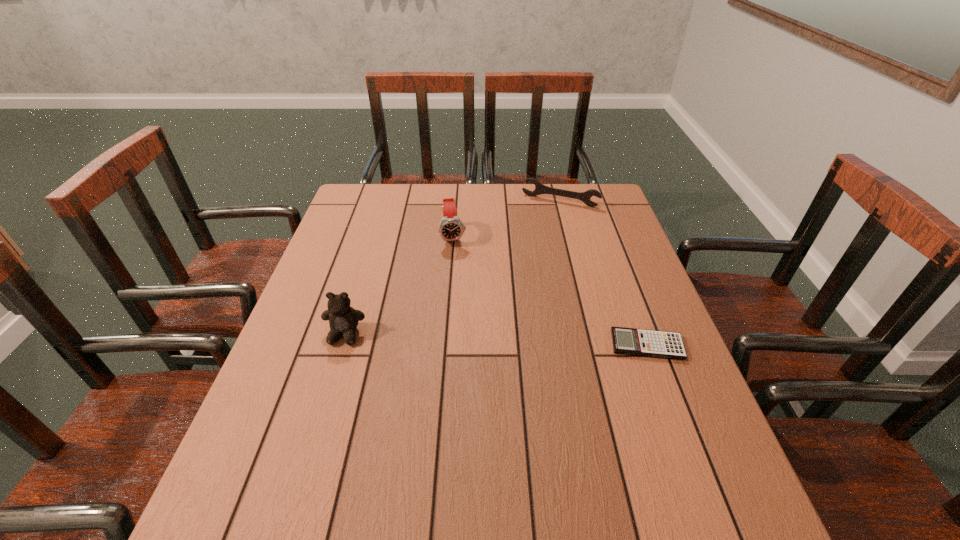
The width and height of the screenshot is (960, 540). In order to click on the leftmost object in this screenshot , I will do `click(343, 319)`.

This screenshot has height=540, width=960. In order to click on the shortest object in this screenshot , I will do `click(658, 344)`.

Where is `the third tallest object`? This screenshot has height=540, width=960. the third tallest object is located at coordinates (585, 197).

Find the location of a particular element. This screenshot has height=540, width=960. the farthest object is located at coordinates (585, 197).

The image size is (960, 540). I want to click on watch, so click(x=451, y=228).

Find the location of a particular element. the second object from left to right is located at coordinates point(451,228).

Where is `vacant region located on the face of the teddy bear`? Image resolution: width=960 pixels, height=540 pixels. vacant region located on the face of the teddy bear is located at coordinates (301, 476).

This screenshot has height=540, width=960. I want to click on blank space located on the left of the shortest object, so click(564, 345).

Identify the location of free point located on the open ends of the second shortest object. This screenshot has height=540, width=960. click(x=520, y=269).

The width and height of the screenshot is (960, 540). Identify the location of vacant area situated on the open ends of the second shortest object. (542, 221).